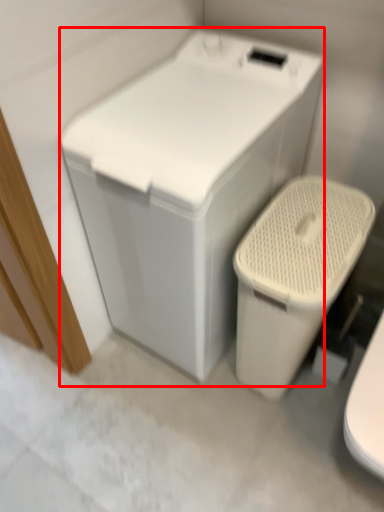
Question: From the image's perspective, considering the relative positions of washing machine (annotated by the red box) and toilet in the image provided, where is washing machine (annotated by the red box) located with respect to the staircase?

Choices:
 (A) above
 (B) below

Answer: (A)